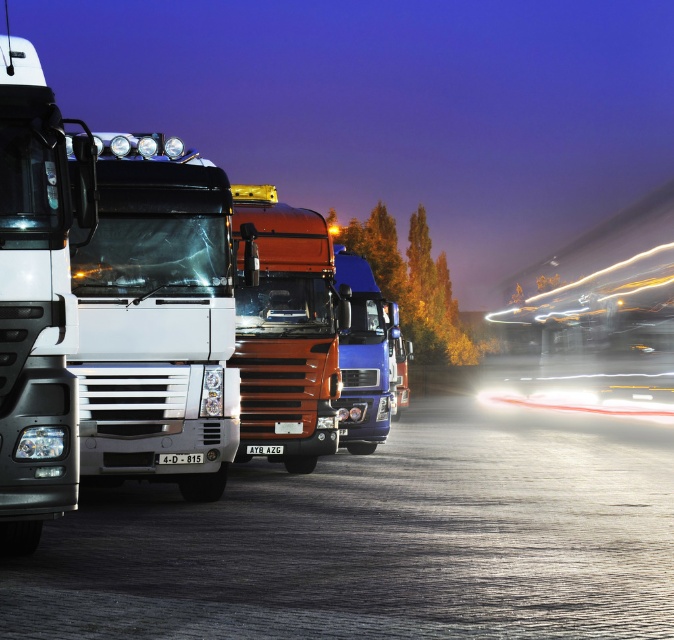
Does shiny orange truck at center have a smaller size compared to matte white headlight at left?

Actually, shiny orange truck at center might be larger than matte white headlight at left.

Does shiny orange truck at center appear under matte white headlight at left?

Incorrect, shiny orange truck at center is not positioned below matte white headlight at left.

Where is `shiny orange truck at center`? Image resolution: width=674 pixels, height=640 pixels. shiny orange truck at center is located at coordinates (284, 332).

Can you confirm if white glossy trailer truck at left is thinner than shiny orange truck at center?

Yes, white glossy trailer truck at left is thinner than shiny orange truck at center.

Which is more to the left, white glossy trailer truck at left or shiny orange truck at center?

Positioned to the left is white glossy trailer truck at left.

Is point (30, 355) positioned before point (274, 291)?

Yes, point (30, 355) is closer to viewer.

Image resolution: width=674 pixels, height=640 pixels. I want to click on white glossy trailer truck at left, so click(x=32, y=300).

Is point (3, 493) closer to camera compared to point (61, 456)?

Yes, it is.

Between point (22, 291) and point (47, 452), which one is positioned in front?

Positioned in front is point (22, 291).

Between point (7, 216) and point (36, 442), which one is positioned in front?

Positioned in front is point (36, 442).

I want to click on white glossy trailer truck at left, so click(x=32, y=300).